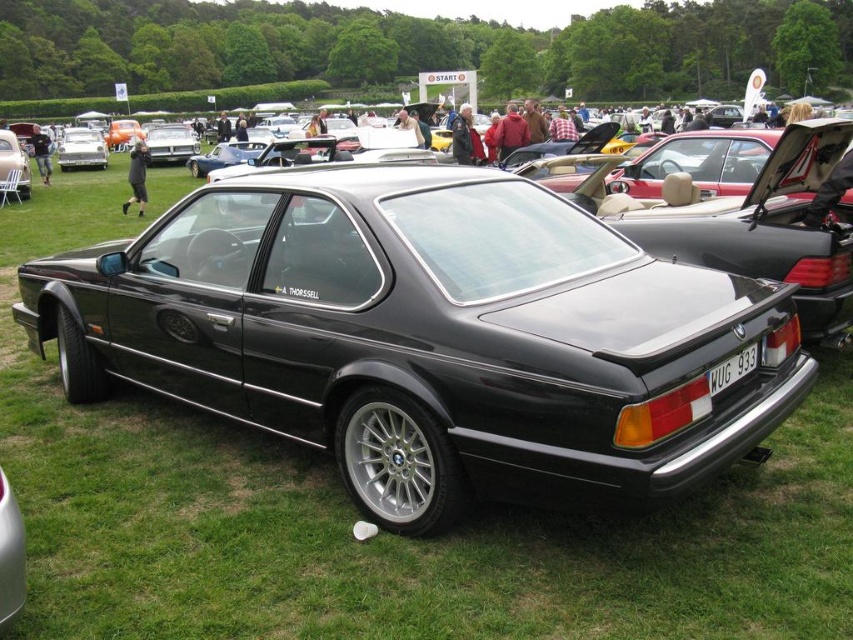
Is point (91, 144) farther from viewer compared to point (733, 381)?

Yes, it is behind point (733, 381).

Who is higher up, metallic silver car at center or white plastic license plate at center?

Positioned higher is metallic silver car at center.

Between point (103, 147) and point (735, 380), which one is positioned behind?

Point (103, 147)

Locate an element on the screen. metallic silver car at center is located at coordinates (80, 148).

Does point (15, 144) come in front of point (732, 378)?

No, it is not.

Who is taller, matte black car at center or white plastic license plate at center?

Standing taller between the two is matte black car at center.

Does point (22, 163) come farther from viewer compared to point (755, 365)?

Yes.

Identify the location of matte black car at center. This screenshot has height=640, width=853. (13, 163).

Which is in front, point (62, 144) or point (6, 132)?

Positioned in front is point (6, 132).

Who is lower down, metallic silver car at center or matte black car at center?

Positioned lower is matte black car at center.

Find the location of a particular element. This screenshot has height=640, width=853. metallic silver car at center is located at coordinates (80, 148).